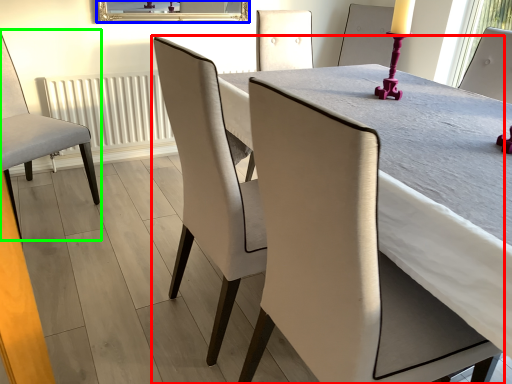
Question: Estimate the real-world distances between objects in this image. Which object is farther from chair (highlighted by a red box), mirror (highlighted by a blue box) or chair (highlighted by a green box)?

Choices:
 (A) mirror
 (B) chair

Answer: (A)